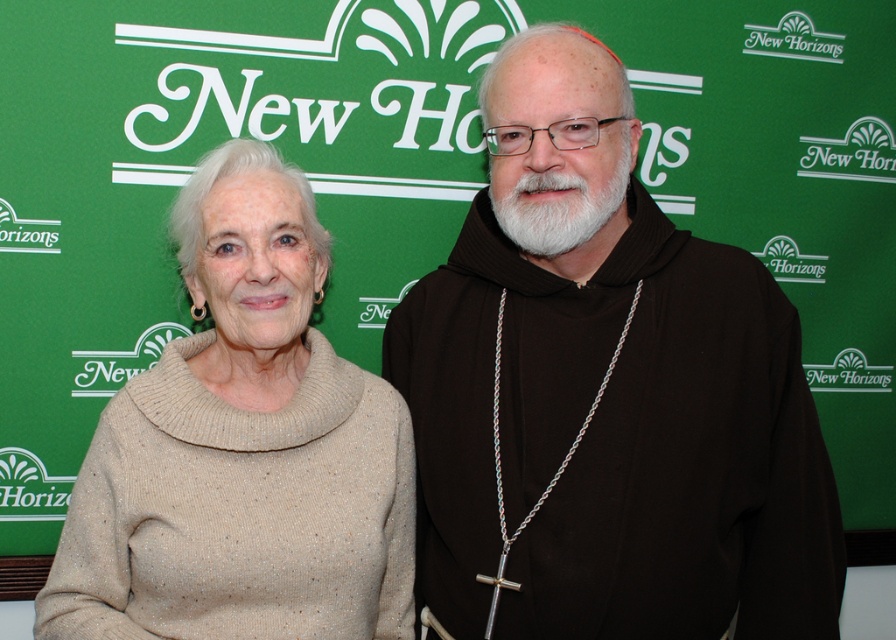
Question: Does brown woolen robe at center have a larger size compared to beige sweater at left?

Choices:
 (A) no
 (B) yes

Answer: (B)

Question: Which point is closer to the camera taking this photo?

Choices:
 (A) click(x=622, y=134)
 (B) click(x=147, y=369)

Answer: (A)

Question: Which point is farther to the camera?

Choices:
 (A) (750, 499)
 (B) (216, 195)

Answer: (A)

Question: Is the position of brown woolen robe at center less distant than that of beige sweater at left?

Choices:
 (A) no
 (B) yes

Answer: (A)

Question: Can you confirm if brown woolen robe at center is positioned to the left of beige sweater at left?

Choices:
 (A) no
 (B) yes

Answer: (A)